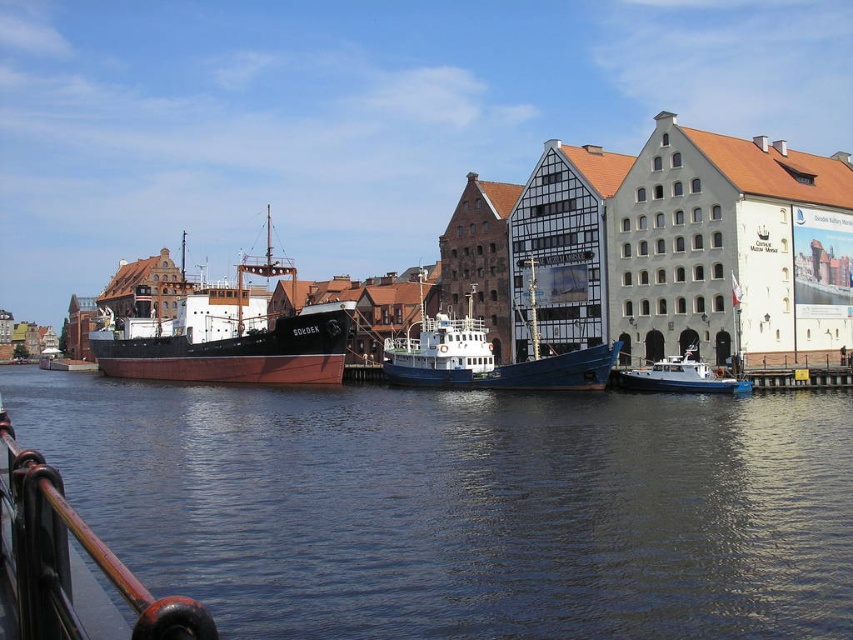
Question: Which point is farther to the camera?

Choices:
 (A) (691, 376)
 (B) (790, 483)
 (C) (155, 328)
 (D) (148, 612)

Answer: (C)

Question: Is brown matte ship at left above polished metal railing at lower left?

Choices:
 (A) no
 (B) yes

Answer: (B)

Question: Which point is farther to the camera?

Choices:
 (A) (624, 369)
 (B) (166, 332)
 (C) (488, 376)

Answer: (B)

Question: Does dark blue water at center appear on the right side of white matte boat at lower right?

Choices:
 (A) no
 (B) yes

Answer: (A)

Question: Estimate the real-world distances between objects in this image. Which object is closer to the white matte boat at lower right?

Choices:
 (A) brown matte ship at left
 (B) polished metal railing at lower left
 (C) dark blue water at center

Answer: (C)

Question: Does dark blue water at center have a smaller size compared to blue polished wood boat at center?

Choices:
 (A) no
 (B) yes

Answer: (A)